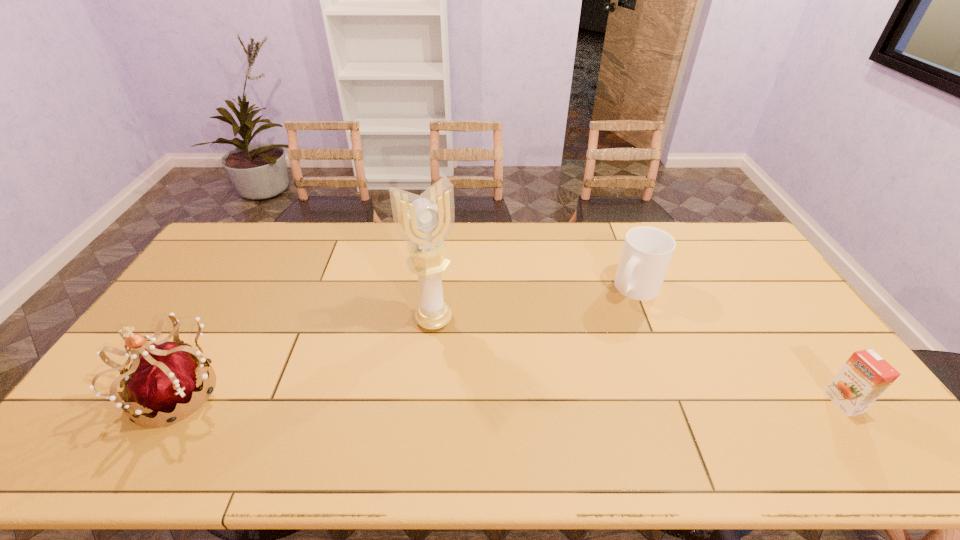
At what (x,y) coordinates should I click in order to perform the action: click on vacant space on the desktop that is between the third shortest object and the rightmost object and is positioned on the handle side of the third object from left to right. Please return your answer as a coordinate pair (x, y). Image resolution: width=960 pixels, height=540 pixels. Looking at the image, I should click on (568, 398).

This screenshot has height=540, width=960. In order to click on free spot on the desktop that is between the leftmost object and the orange juice and is positioned on the front-facing side of the third object from right to left in this screenshot , I will do `click(472, 396)`.